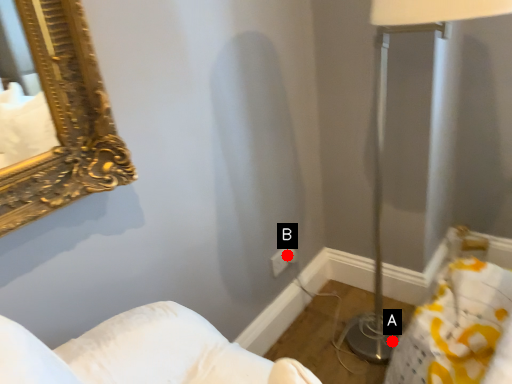
Question: Two points are circled on the image, labeled by A and B beside each circle. Which point is farther to the camera?

Choices:
 (A) A is further
 (B) B is further

Answer: (B)